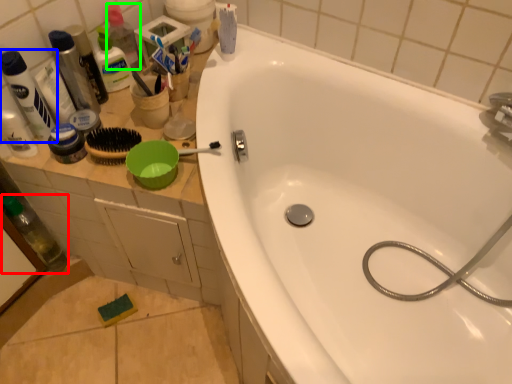
Question: Based on their relative distances, which object is farther from bottle (highlighted by a red box)? Choose from toiletry (highlighted by a blue box) and bottle (highlighted by a green box).

Choices:
 (A) toiletry
 (B) bottle

Answer: (B)